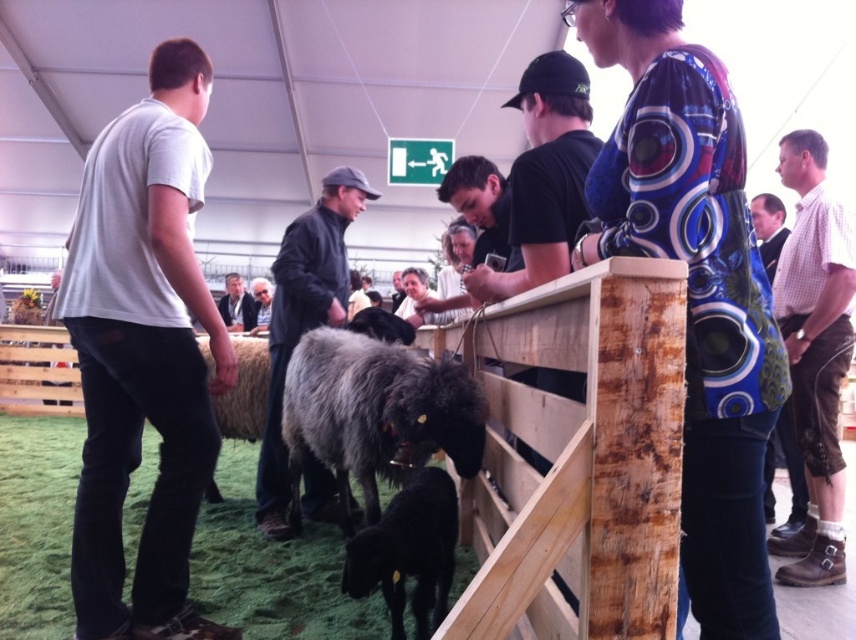
You are a photographer standing at the center of the tent, and you want to take a photo of both the checkered shirt at right and the light brown leather jacket at upper right. Can you fit both subjects into your camera frame if your camera has a maximum horizontal field of view of 18 inches?

The distance between the checkered shirt at right and the light brown leather jacket at upper right is 17.97 inches, which is just under the camera frame limit of 18 inches. Therefore, both subjects can be captured in the same photo.